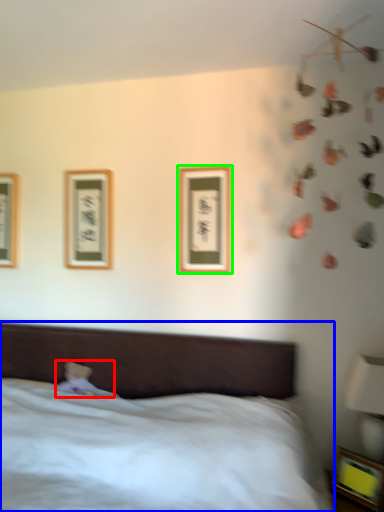
Question: Which object is positioned farthest from toy (highlighted by a red box)? Select from bed (highlighted by a blue box) and picture frame (highlighted by a green box).

Choices:
 (A) bed
 (B) picture frame

Answer: (B)